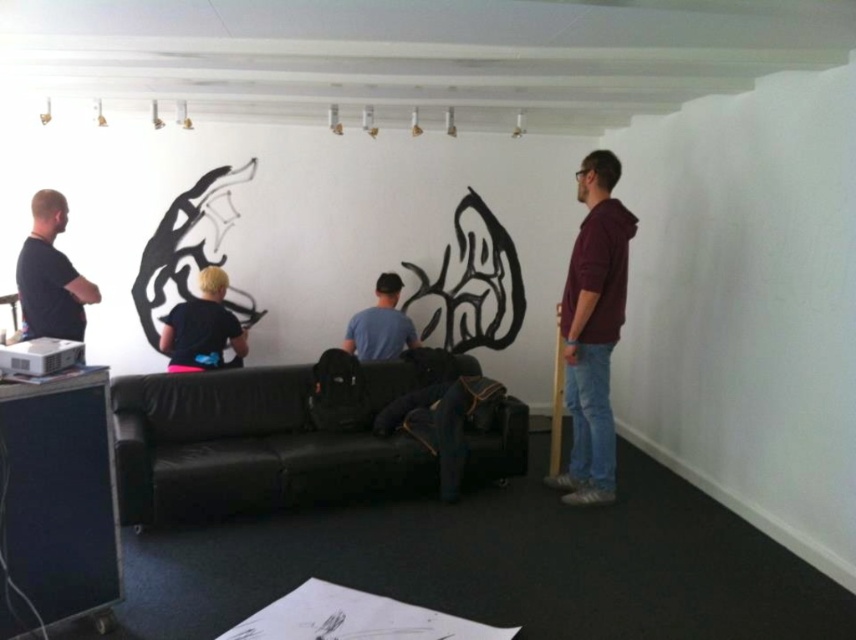
You are a delivery person who needs to place a small package between the black leather couch at center and the black matte shirt at left. Is there enough space to fit the package?

The black leather couch at center is 36.36 inches away from the black matte shirt at left. Since the package is small, there is sufficient space between them to place it.

From the picture: You are standing at the entrance of the room and want to sit on the black leather couch at center. According to the coordinates provided, in which direction should you move relative to your current position?

The black leather couch at center is located at coordinates point (254,444). Since you are at the entrance, you should move towards the direction of the couch based on the coordinate system provided.

You are standing at the entrance of the room and want to reach the point marked as point (x=194, y=486). To do this, you must first pass through point (x=58, y=202). Is this path possible?

Yes, the path is possible because point (x=194, y=486) is in front of point (x=58, y=202), so you can move from the entrance through point (x=58, y=202) to reach point (x=194, y=486).